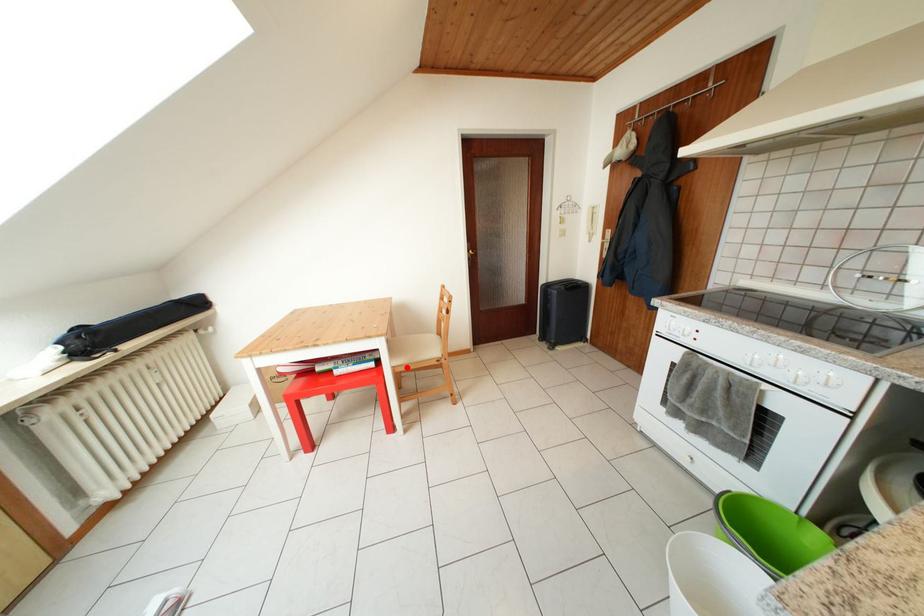
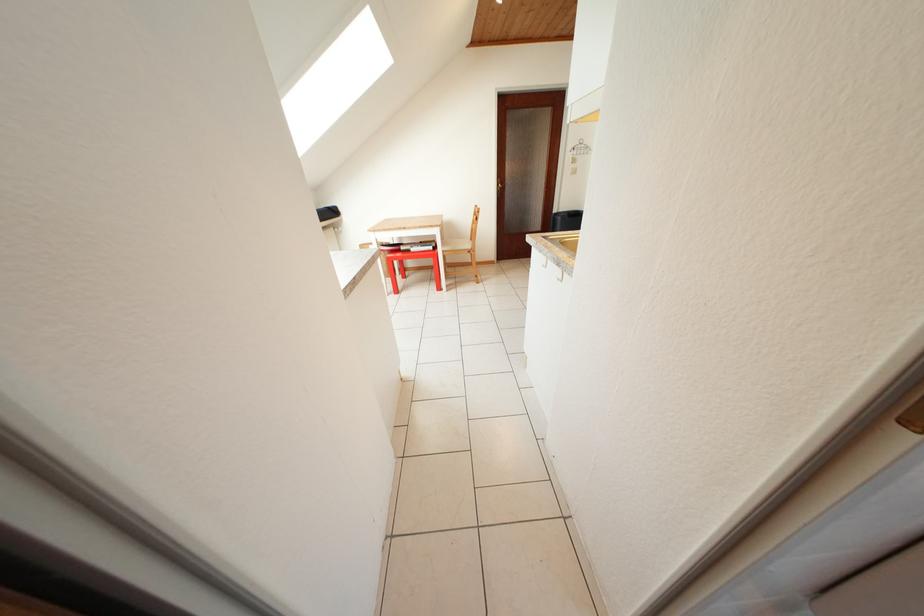
Question: A red point is marked in image1. In image2, is the corresponding 3D point closer to the camera or farther? Reply with the corresponding letter.

Choices:
 (A) The corresponding 3D point is closer.
 (B) The corresponding 3D point is farther.

Answer: (A)